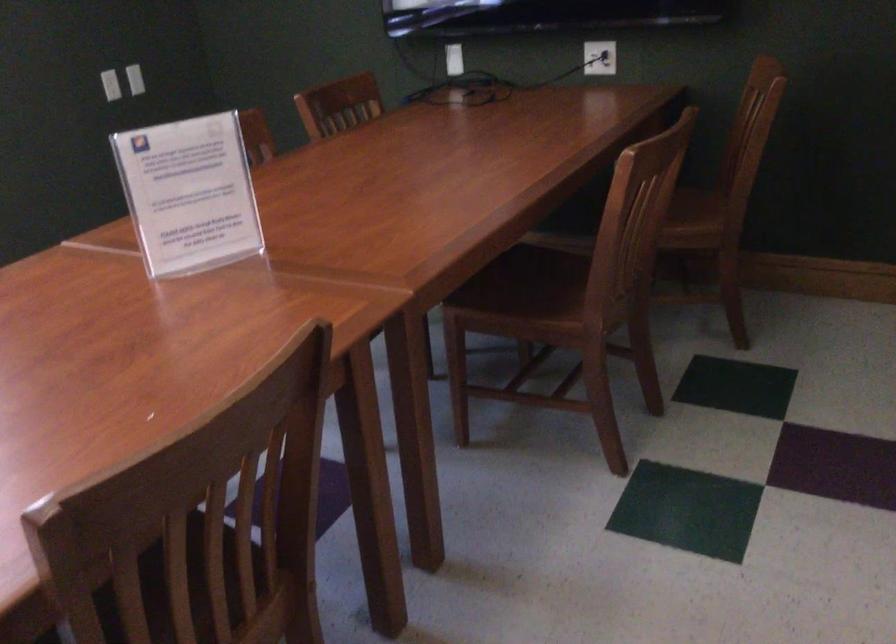
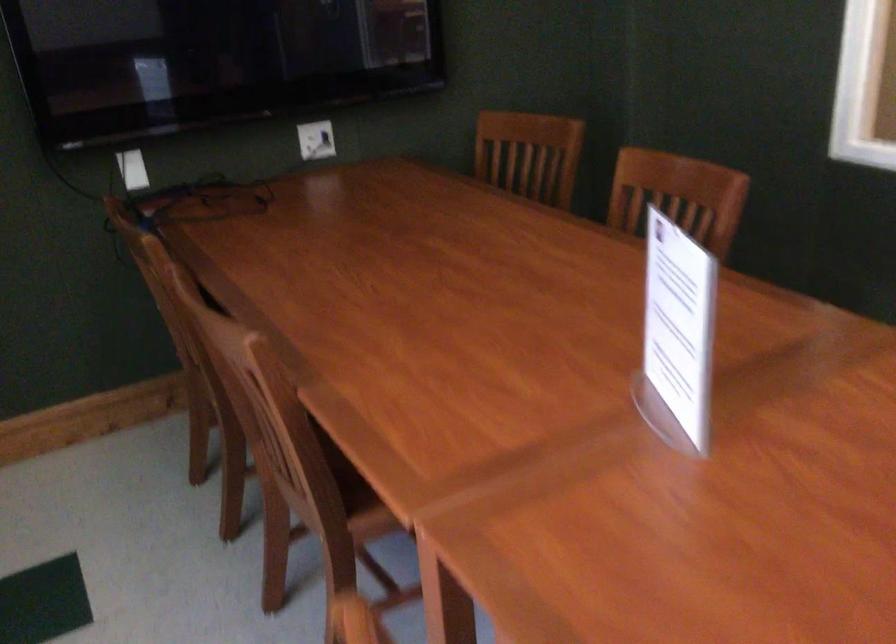
In the second image, find the point that corresponds to point 746,113 in the first image.

(529, 154)